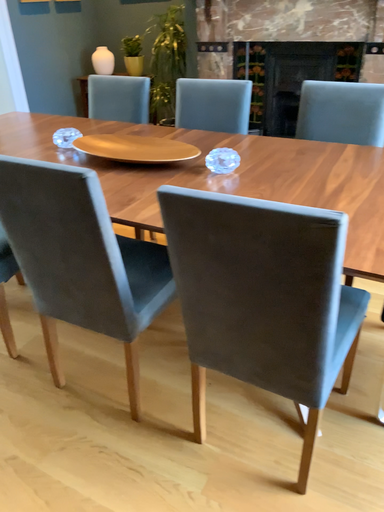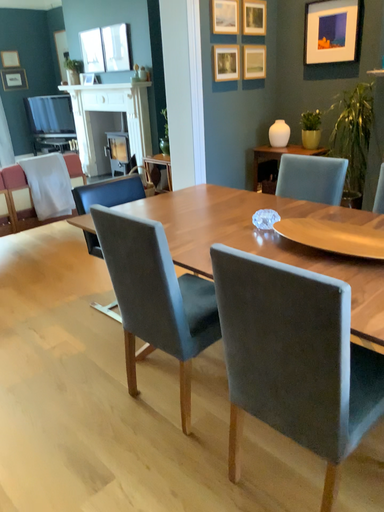
Question: How did the camera likely rotate when shooting the video?

Choices:
 (A) rotated upward
 (B) rotated downward

Answer: (A)